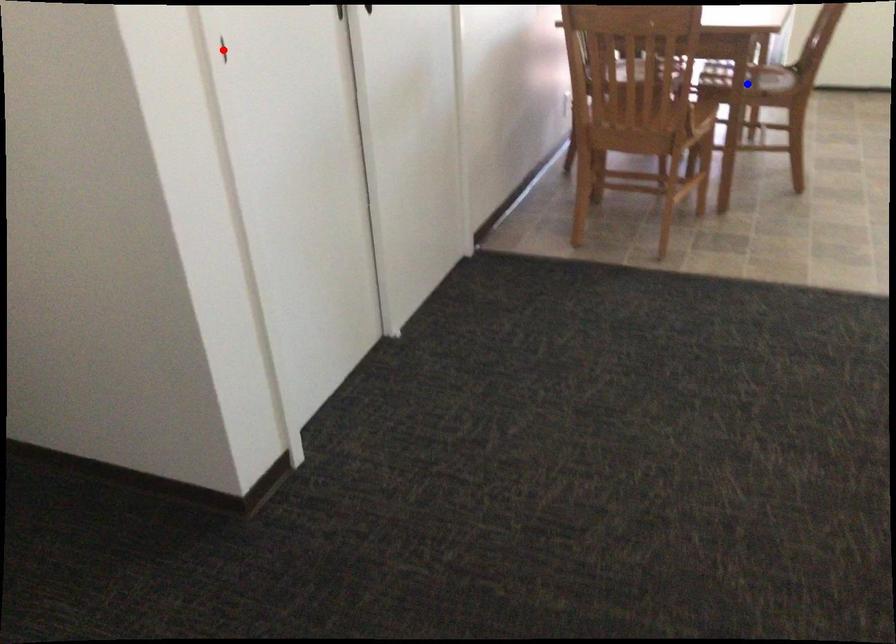
Question: In the image, two points are highlighted. Which point is nearer to the camera? Reply with the corresponding letter.

Choices:
 (A) blue point
 (B) red point

Answer: (B)